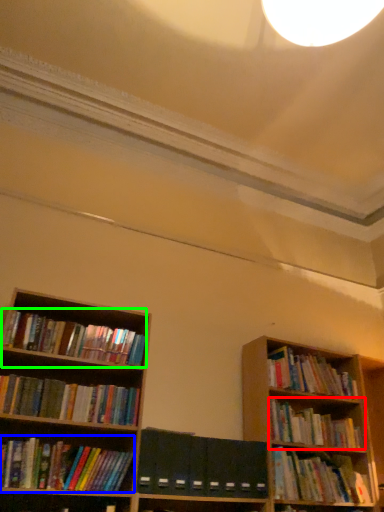
Question: Which object is positioned closest to book (highlighted by a red box)? Select from book (highlighted by a blue box) and book (highlighted by a green box).

Choices:
 (A) book
 (B) book

Answer: (A)